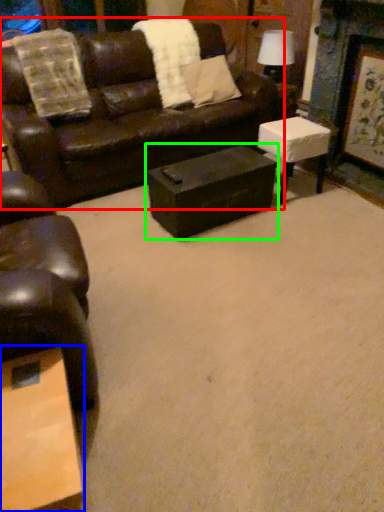
Question: Considering the real-world distances, which object is closest to studio couch (highlighted by a red box)? coffee table (highlighted by a blue box) or table (highlighted by a green box).

Choices:
 (A) coffee table
 (B) table

Answer: (B)